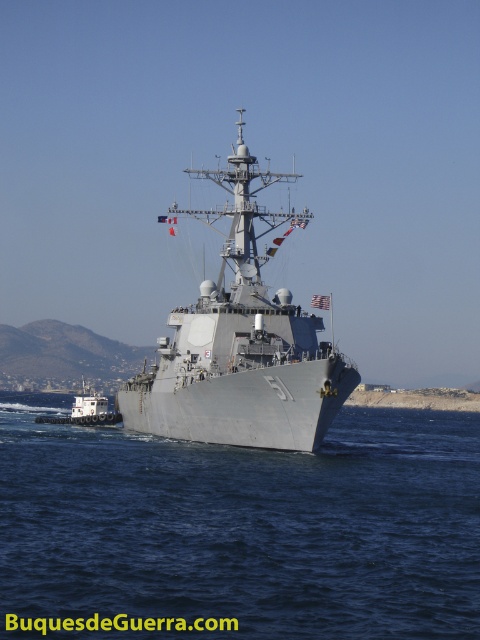
You are an observer on a nearby boat and see the gray metallic water at center and the gray metallic warship at center. Which object is closer to you?

The gray metallic water at center is closer to the viewer than the gray metallic warship at center.

You are a pilot flying a small aircraft and need to land on the gray metallic warship at center. However, you notice the white matte tugboat at lower left nearby. Based on their positions, will the tugboat interfere with your landing path?

The gray metallic warship at center is above the white matte tugboat at lower left, so the tugboat is positioned lower and would not interfere with the landing path on the gray metallic warship at center.